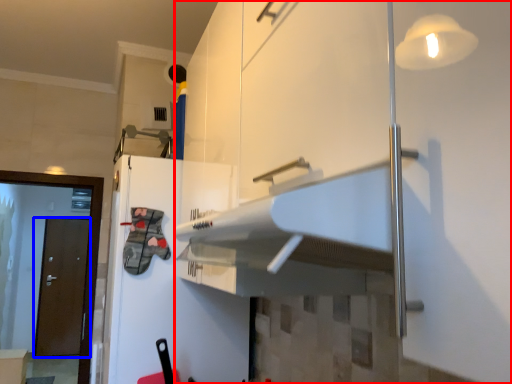
Question: Among these objects, which one is farthest to the camera, cabinetry (highlighted by a red box) or door (highlighted by a blue box)?

Choices:
 (A) cabinetry
 (B) door

Answer: (B)